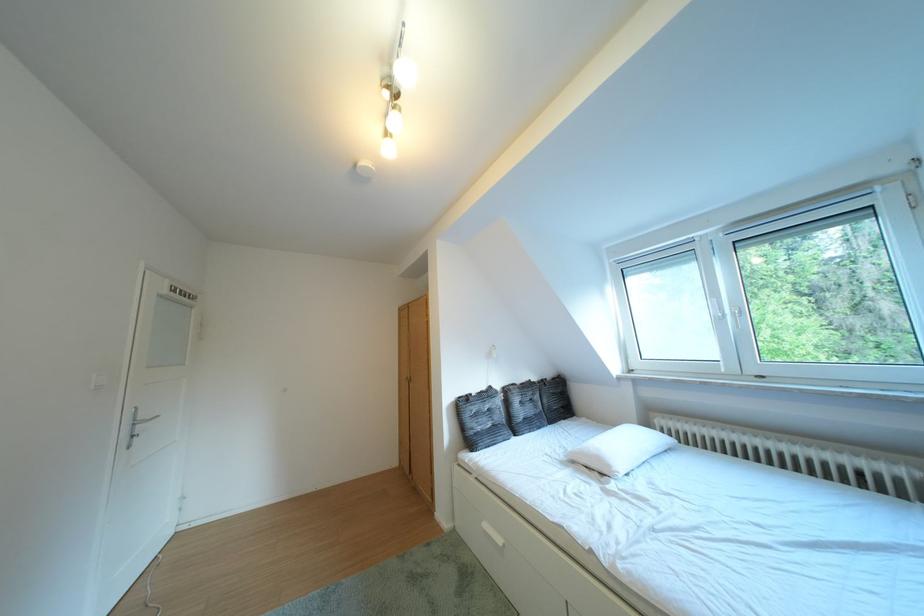
Describe the element at coordinates (99, 379) in the screenshot. The height and width of the screenshot is (616, 924). I see `the white light switch` at that location.